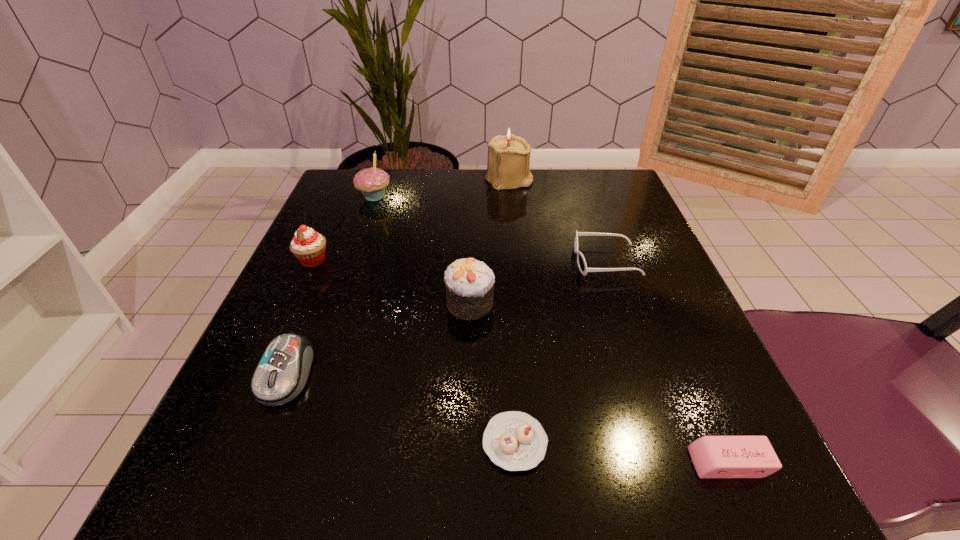
Where is `vacant space that satisfies the following two spatial constraints: 1. with the lenses of the eraser facing outward; 2. on the left side of the sunglasses`? Image resolution: width=960 pixels, height=540 pixels. vacant space that satisfies the following two spatial constraints: 1. with the lenses of the eraser facing outward; 2. on the left side of the sunglasses is located at coordinates (675, 463).